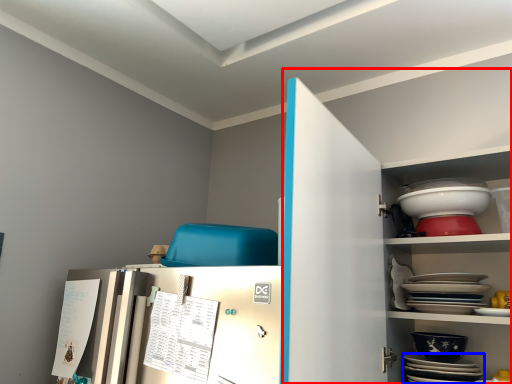
Question: Which object is closer to the camera taking this photo, dresser (highlighted by a red box) or platter (highlighted by a blue box)?

Choices:
 (A) dresser
 (B) platter

Answer: (A)